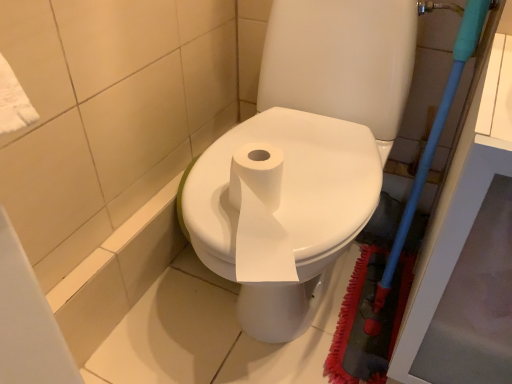
Question: Is point (308, 271) closer or farther from the camera than point (401, 226)?

Choices:
 (A) closer
 (B) farther

Answer: (A)

Question: Considering their positions, is white glossy toilet at center located in front of or behind blue plastic brush at right?

Choices:
 (A) behind
 (B) front

Answer: (A)

Question: From a real-world perspective, is white glossy toilet at center positioned above or below blue plastic brush at right?

Choices:
 (A) above
 (B) below

Answer: (A)

Question: In terms of width, does blue plastic brush at right look wider or thinner when compared to white glossy toilet at center?

Choices:
 (A) wide
 (B) thin

Answer: (B)

Question: Is blue plastic brush at right inside or outside of white glossy toilet at center?

Choices:
 (A) inside
 (B) outside

Answer: (B)

Question: Considering the positions of blue plastic brush at right and white glossy toilet at center in the image, is blue plastic brush at right bigger or smaller than white glossy toilet at center?

Choices:
 (A) big
 (B) small

Answer: (B)

Question: Is point (421, 157) positioned closer to the camera than point (311, 127)?

Choices:
 (A) farther
 (B) closer

Answer: (B)